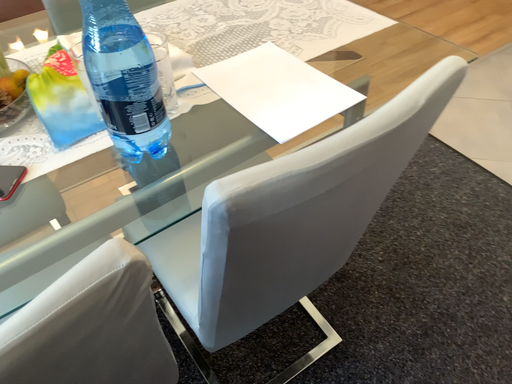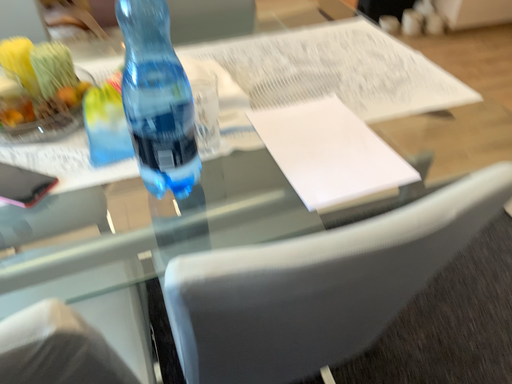
Question: Which way did the camera rotate in the video?

Choices:
 (A) rotated left
 (B) rotated right

Answer: (A)